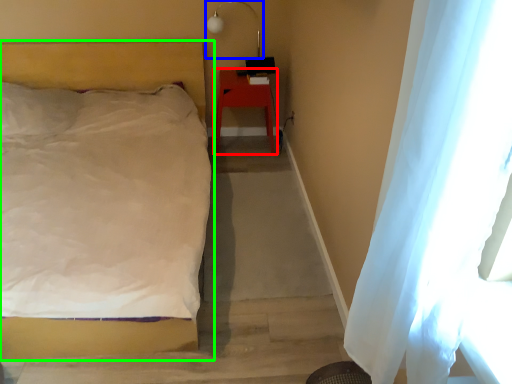
Question: Which is nearer to the furniture (highlighted by a red box)? lamp (highlighted by a blue box) or bed (highlighted by a green box).

Choices:
 (A) lamp
 (B) bed

Answer: (A)